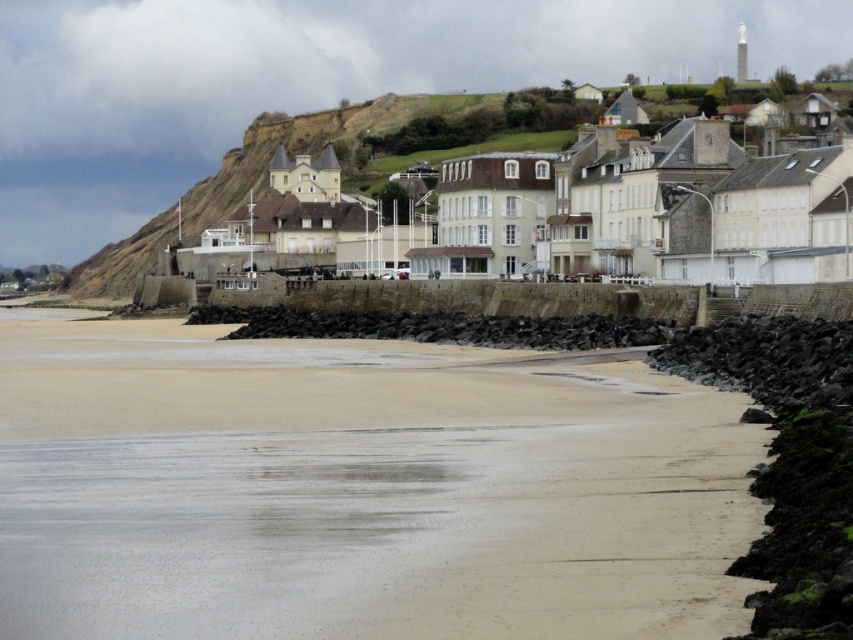
You are standing at the edge of the cliff overlooking the coastal scene. You notice two points marked in the image. Which point, point (148, 397) or point (392, 225), is closer to your current position?

Point (148, 397) is closer to the camera than point (392, 225), so it is closer to your current position.

You are a tourist standing on the sandy beach at lower center and want to reach the white stone buildings at center. Which direction should you walk to get there?

The sandy beach at lower center is positioned on the left side of white stone buildings at center, so you should walk to the right to reach the white stone buildings at center.

You are a photographer planning to capture the entire scene in one shot. Given that the sandy beach at lower center and the white stone buildings at center are both in view, which area will occupy more of the photo frame?

The white stone buildings at center occupy more space than the sandy beach at lower center in the photo frame because the sandy beach at lower center occupies less space than white stone buildings at center.